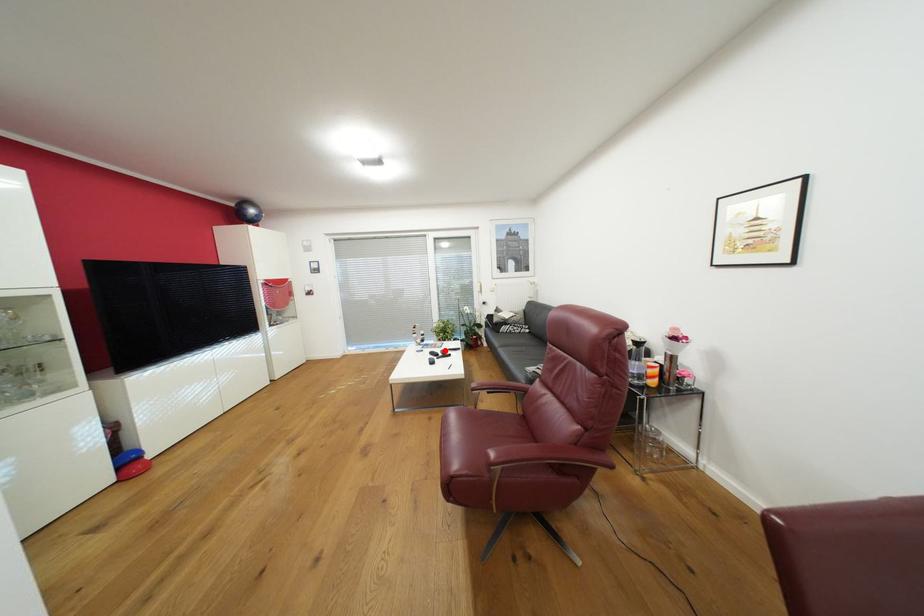
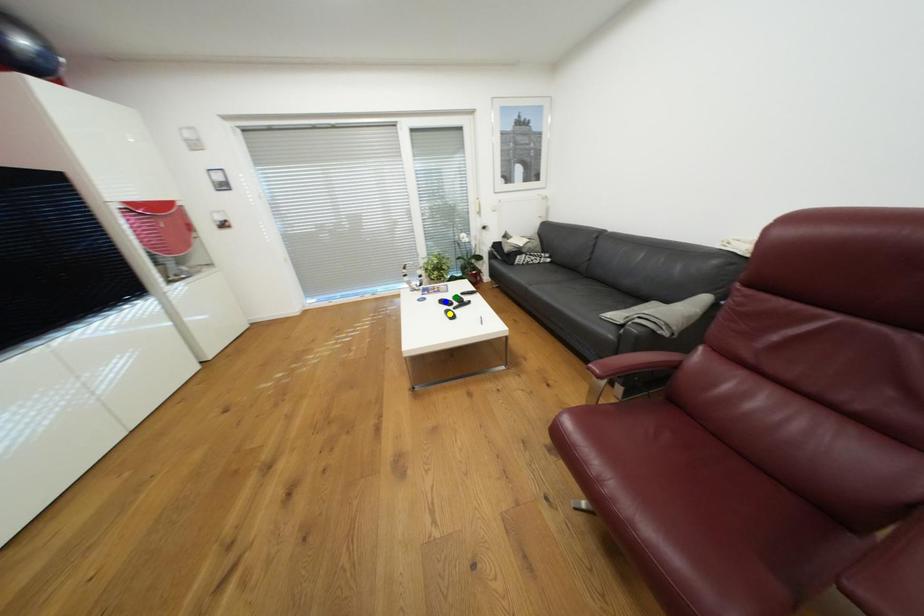
Question: I am providing you with two images of the same scene from different viewpoints. A red point is marked on the first image. You are given multiple points on the second image. In image 2, which mark is for the same physical point as the one in image 1?

Choices:
 (A) yellow point
 (B) green point
 (C) blue point

Answer: (B)